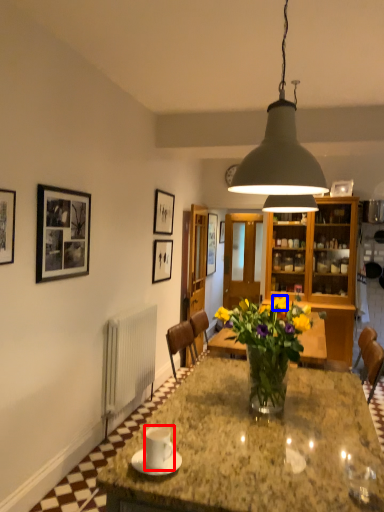
Question: Which of the following is the closest to the observer, coffee cup (highlighted by a red box) or flower (highlighted by a blue box)?

Choices:
 (A) coffee cup
 (B) flower

Answer: (A)